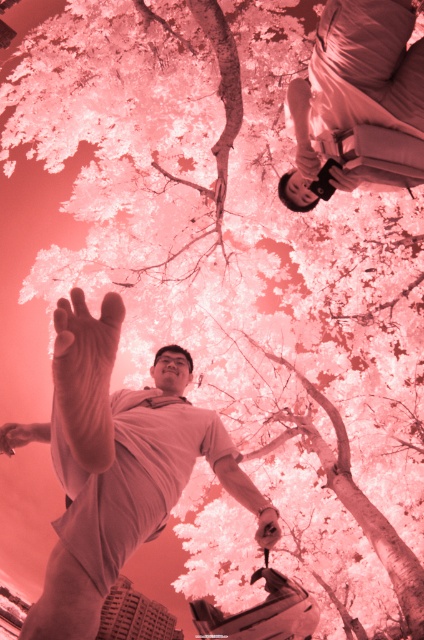
Between point (103, 532) and point (409, 150), which one is positioned in front?

Point (103, 532) is in front.

Which is in front, point (33, 422) or point (416, 124)?

Positioned in front is point (416, 124).

Where is `white cotton shirt at center`? The width and height of the screenshot is (424, 640). white cotton shirt at center is located at coordinates (113, 468).